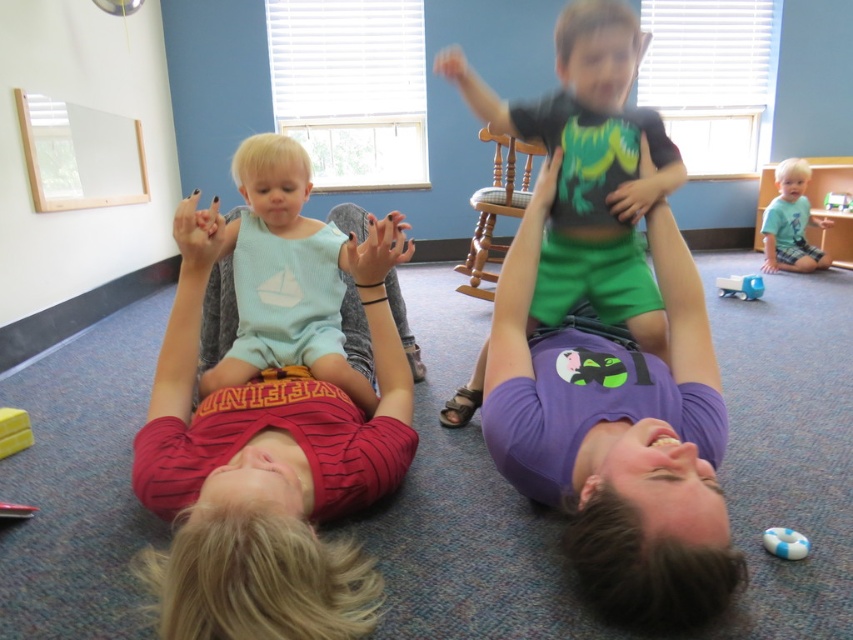
You are a parent trying to retrieve the yellow rubber toy at lower left from across the room where the wooden rocking chair at upper center is located. Can you reach it without moving from your current position?

The distance between the wooden rocking chair at upper center and the yellow rubber toy at lower left is 7.39 feet. Since you are at the wooden rocking chair at upper center, you would need to move closer to reach the yellow rubber toy at lower left as the distance is too far to reach without moving.

You are a parent trying to hand your child the yellow rubber toy at lower left. The child is currently holding the light blue jersey at center. Can you reach the toy without moving the jersey?

The light blue jersey at center and yellow rubber toy at lower left are 29.63 inches apart from each other. Since the distance between them is more than arm length, you cannot reach the yellow rubber toy at lower left without moving the light blue jersey at center.

Consider the image. You are a toddler in the room and want to reach the wooden rocking chair at upper center. Which direction should you move from the yellow rubber toy at lower left?

The wooden rocking chair at upper center is to the right of the yellow rubber toy at lower left, so you should move to the right to reach it.